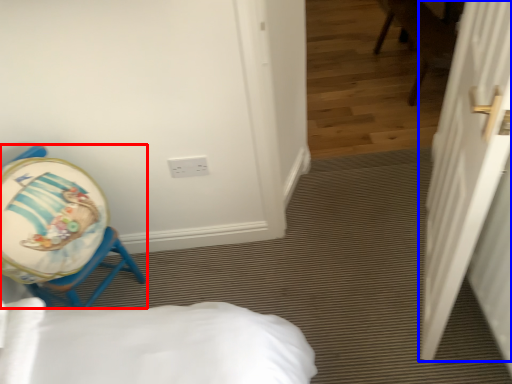
Question: Among these objects, which one is farthest to the camera, chair (highlighted by a red box) or door (highlighted by a blue box)?

Choices:
 (A) chair
 (B) door

Answer: (A)